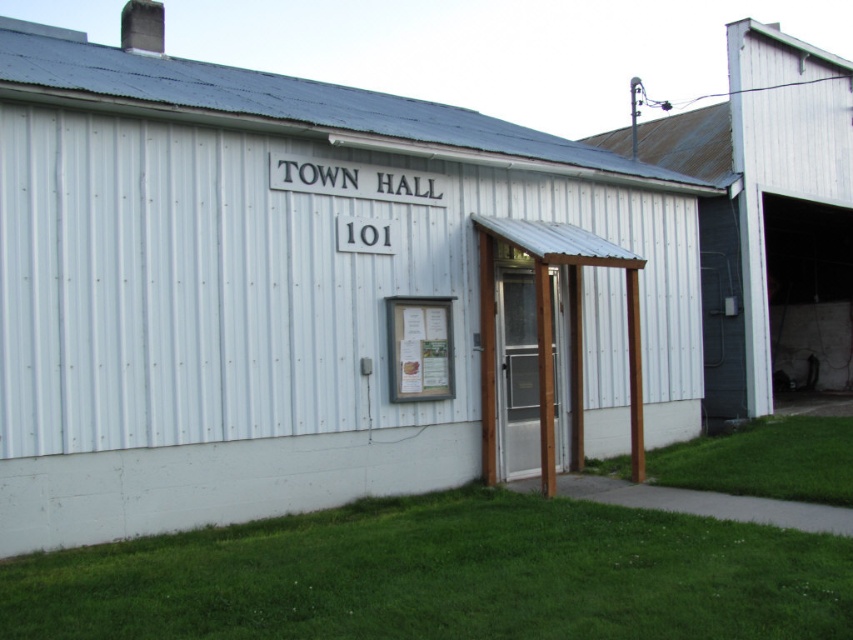
Question: Does green grass at lower center have a greater width compared to white corrugated metal barn at right?

Choices:
 (A) yes
 (B) no

Answer: (B)

Question: Which of the following is the closest to the observer?

Choices:
 (A) (776, 472)
 (B) (798, 371)
 (C) (618, 588)

Answer: (C)

Question: Can you confirm if green grass at lower center is wider than white corrugated metal barn at right?

Choices:
 (A) yes
 (B) no

Answer: (B)

Question: Which object appears farthest from the camera in this image?

Choices:
 (A) green grass at lower center
 (B) white corrugated metal barn at right

Answer: (B)

Question: Which point appears closest to the camera in this image?

Choices:
 (A) (302, 593)
 (B) (721, 452)

Answer: (A)

Question: Is the position of green grass at lower center less distant than that of green grass at lower right?

Choices:
 (A) yes
 (B) no

Answer: (A)